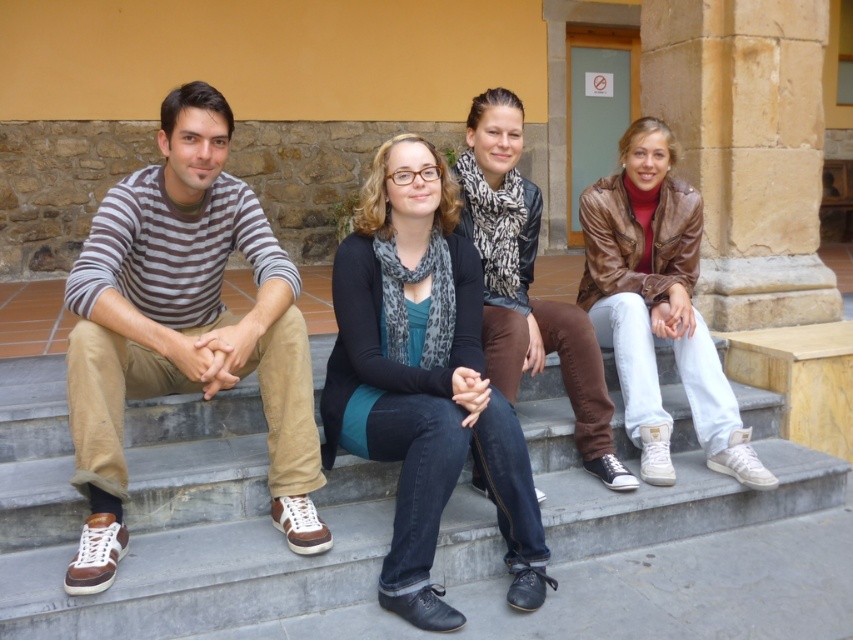
The image size is (853, 640). I want to click on brown stone pillar at right, so click(x=746, y=148).

What do you see at coordinates (746, 148) in the screenshot? I see `brown stone pillar at right` at bounding box center [746, 148].

Find the location of `brown stone pillar at right`. brown stone pillar at right is located at coordinates (746, 148).

Is brown suede shoes at left wider than brown leather jacket at lower right?

Correct, the width of brown suede shoes at left exceeds that of brown leather jacket at lower right.

Where is `brown suede shoes at left`? The height and width of the screenshot is (640, 853). brown suede shoes at left is located at coordinates (183, 326).

Which is below, brown stone pillar at right or leopard print scarf at center?

Positioned lower is leopard print scarf at center.

Between brown stone pillar at right and leopard print scarf at center, which one appears on the left side from the viewer's perspective?

From the viewer's perspective, leopard print scarf at center appears more on the left side.

Is point (805, 202) closer to camera compared to point (579, 426)?

No, (805, 202) is further to viewer.

Find the location of a particular element. The height and width of the screenshot is (640, 853). brown stone pillar at right is located at coordinates (746, 148).